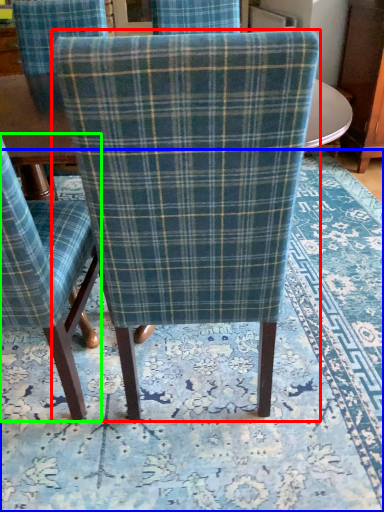
Question: Considering the real-world distances, which object is closest to chair (highlighted by a red box)? mat (highlighted by a blue box) or chair (highlighted by a green box).

Choices:
 (A) mat
 (B) chair

Answer: (B)